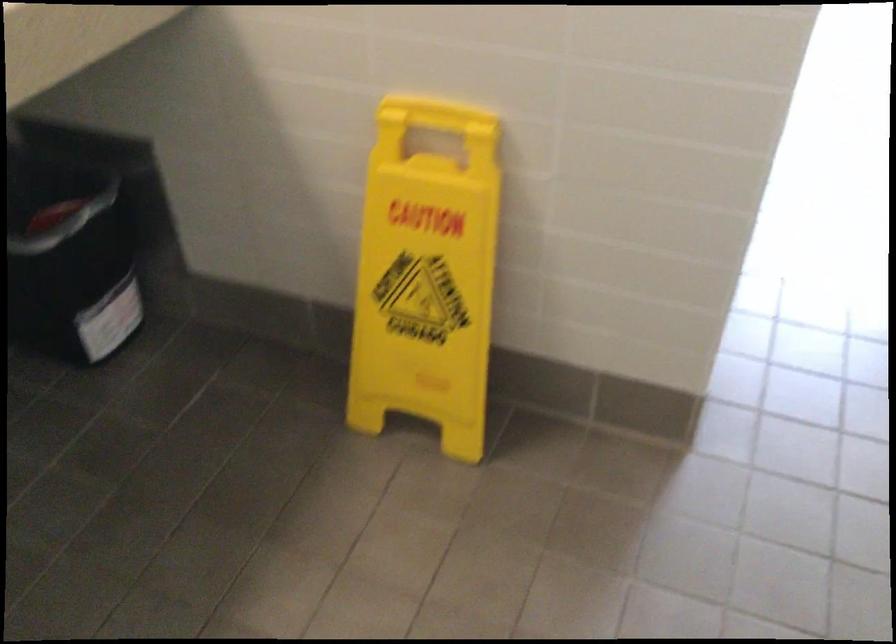
Where is `caution sign handle`? This screenshot has height=644, width=896. caution sign handle is located at coordinates pos(429,114).